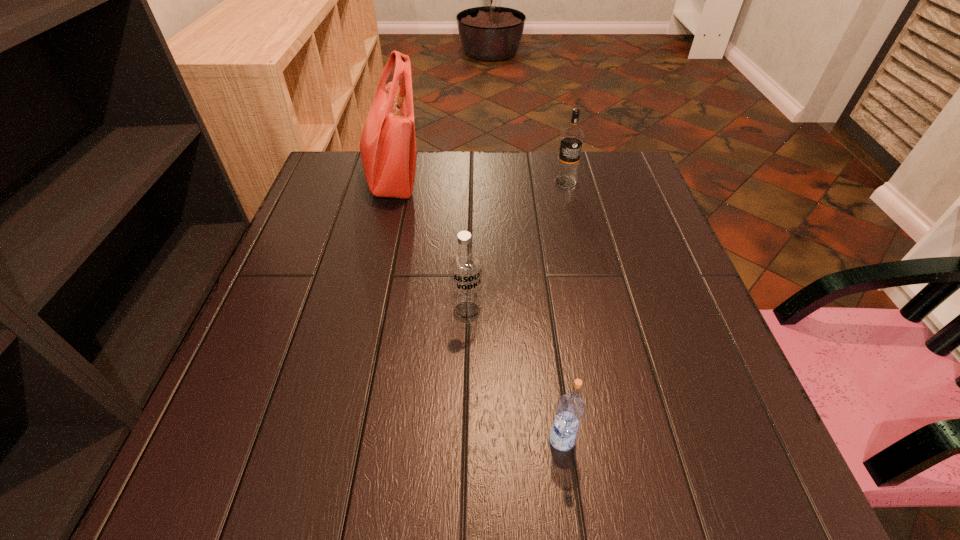
At what (x,y) coordinates should I click in order to perform the action: click on free space at the right edge. Please return your answer as a coordinate pair (x, y). Image resolution: width=960 pixels, height=540 pixels. Looking at the image, I should click on (617, 211).

Where is `free space at the far left corner of the desktop`? The height and width of the screenshot is (540, 960). free space at the far left corner of the desktop is located at coordinates (331, 152).

Locate an element on the screen. The image size is (960, 540). vacant area at the near left corner is located at coordinates (231, 479).

Find the location of a particular element. free region at the far right corner is located at coordinates (639, 176).

In the image, there is a desktop. At what (x,y) coordinates should I click in order to perform the action: click on vacant region at the near right corner. Please return your answer as a coordinate pair (x, y). Looking at the image, I should click on (754, 447).

Find the location of a particular element. Image resolution: width=960 pixels, height=540 pixels. empty space that is in between the shortest object and the rightmost vodka is located at coordinates (564, 310).

This screenshot has height=540, width=960. Find the location of `free area in between the second object from right to left and the third farthest object`. free area in between the second object from right to left and the third farthest object is located at coordinates (515, 375).

At what (x,y) coordinates should I click in order to perform the action: click on vacant area that lies between the second nearest object and the third object from left to right. Please return your answer as a coordinate pair (x, y). Looking at the image, I should click on (515, 375).

The image size is (960, 540). What are the coordinates of `vacant space that's between the handbag and the leftmost vodka` in the screenshot? It's located at (429, 246).

You are a GUI agent. You are given a task and a screenshot of the screen. Output one action in this format:
    pyautogui.click(x=<x>, y=<y>)
    Task: Click on the free space between the rightmost object and the second object from left to right
    This screenshot has height=540, width=960.
    Given the screenshot: What is the action you would take?
    pyautogui.click(x=516, y=247)